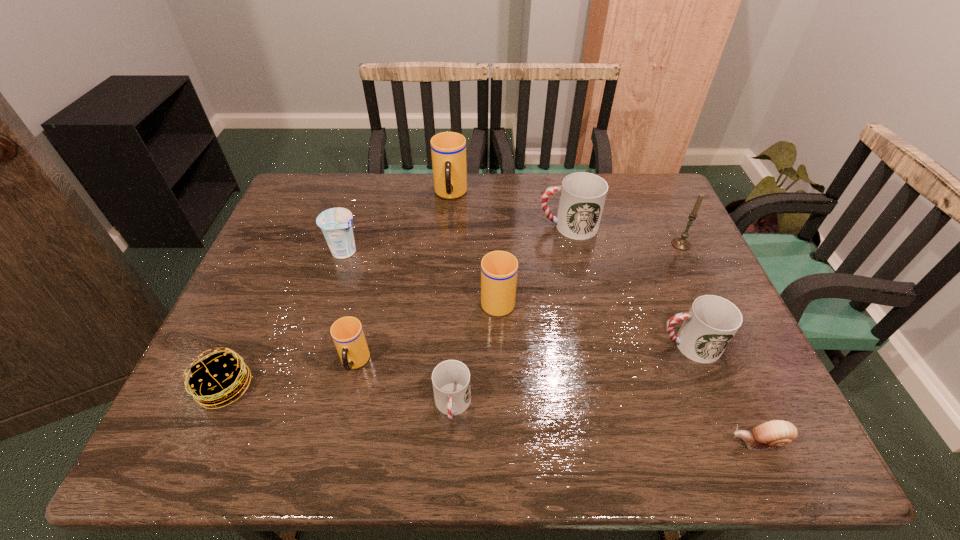
Identify the location of empty space between the escargot and the fifth object from right to left. (628, 370).

The image size is (960, 540). Identify the location of free space that is in between the smallest red cup and the farthest beige cup. (451, 300).

Where is `unoccupied area between the nearest object and the smallest red cup`? The image size is (960, 540). unoccupied area between the nearest object and the smallest red cup is located at coordinates (605, 424).

Identify the location of unoccupied position between the second object from left to right and the escargot. The height and width of the screenshot is (540, 960). (551, 347).

Locate an element on the screen. Image resolution: width=960 pixels, height=540 pixels. unoccupied area between the patty and the tallest cup is located at coordinates (338, 291).

Where is `unoccupied position between the patty and the farthest beige cup`? The height and width of the screenshot is (540, 960). unoccupied position between the patty and the farthest beige cup is located at coordinates [x=338, y=291].

Locate an element on the screen. The width and height of the screenshot is (960, 540). free area in between the escargot and the second smallest red cup is located at coordinates (723, 393).

Select which object is the closest to the candle. Please provide its 2D coordinates. Your answer should be formatted as a tuple, i.e. [(x, y)], where the tuple contains the x and y coordinates of a point satisfying the conditions above.

[(582, 195)]

At what (x,y) coordinates should I click in order to perform the action: click on the sixth closest object to the second object from left to right. Please return your answer as a coordinate pair (x, y). Looking at the image, I should click on tap(582, 195).

Identify which cup is the third closest to the patty. Please provide its 2D coordinates. Your answer should be formatted as a tuple, i.e. [(x, y)], where the tuple contains the x and y coordinates of a point satisfying the conditions above.

[(499, 269)]